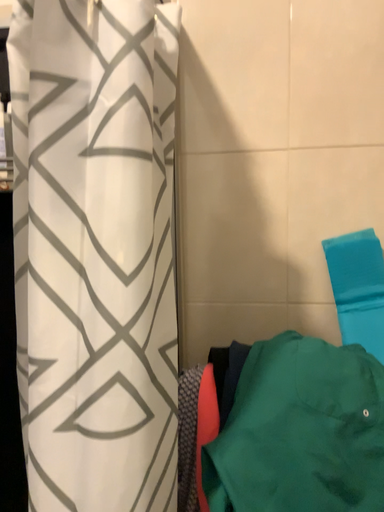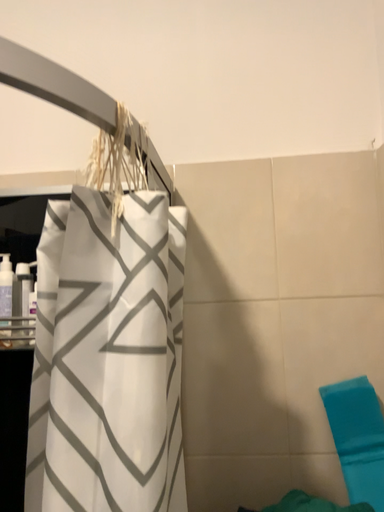
Question: Which way did the camera rotate in the video?

Choices:
 (A) rotated downward
 (B) rotated upward

Answer: (B)